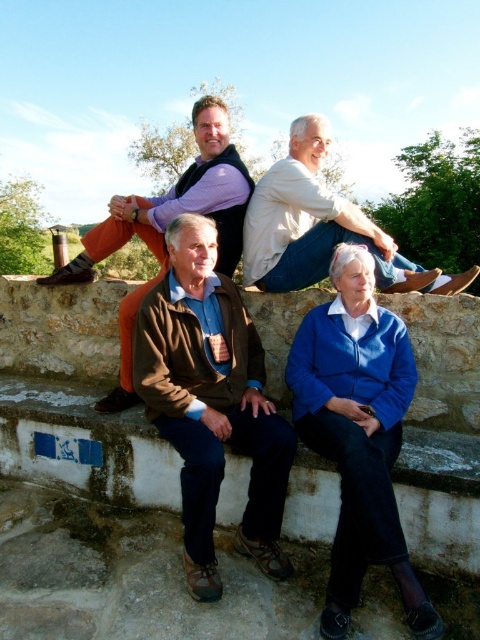
You are a photographer standing in front of the scene. You want to take a photo focusing on the blue leather jacket at lower right and the light beige sweater at upper center. Which of the two items will appear larger in the photo?

The blue leather jacket at lower right will appear larger in the photo because it is closer to the viewer than the light beige sweater at upper center.

You are a photographer trying to capture a photo of the light beige sweater at upper center without the blue leather jacket at lower right appearing in the foreground. Based on their positions, is this possible?

The blue leather jacket at lower right is positioned under the light beige sweater at upper center, so the sweater is above the jacket. By angling the camera upwards to focus on the sweater while keeping the jacket out of the frame, it is possible to capture the sweater without the jacket in the foreground.

You are standing in the countryside and see the brown leather jacket at center and the matte purple shirt at upper center. If you want to hand a book to both people without moving, which one can you reach first?

The brown leather jacket at center is closer to you than the matte purple shirt at upper center, so you can reach the person wearing the brown leather jacket at center first.